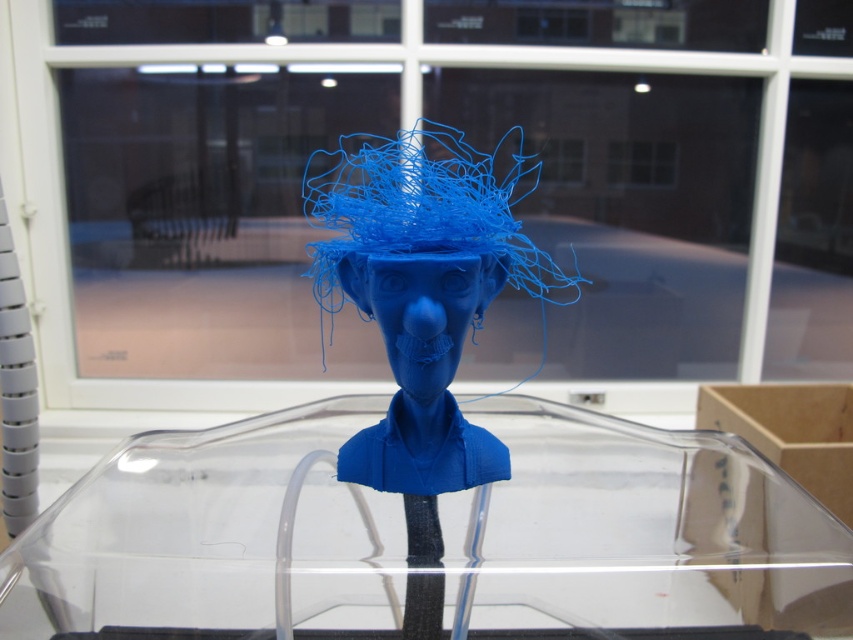
Can you confirm if transparent plastic container at center is bigger than matte plastic bust at center?

Correct, transparent plastic container at center is larger in size than matte plastic bust at center.

Consider the image. Can you confirm if transparent plastic container at center is taller than matte plastic bust at center?

In fact, transparent plastic container at center may be shorter than matte plastic bust at center.

Locate an element on the screen. This screenshot has width=853, height=640. transparent plastic container at center is located at coordinates (440, 538).

Is matte plastic bust at center positioned before matte blue bust at center?

Yes, matte plastic bust at center is closer to the viewer.

Between matte plastic bust at center and matte blue bust at center, which one appears on the left side from the viewer's perspective?

matte plastic bust at center

Is point (463, 225) positioned before point (474, 316)?

Yes, it is.

You are a GUI agent. You are given a task and a screenshot of the screen. Output one action in this format:
    pyautogui.click(x=<x>, y=<y>)
    Task: Click on the matte plastic bust at center
    This screenshot has height=640, width=853.
    Given the screenshot: What is the action you would take?
    pyautogui.click(x=422, y=305)

Can you confirm if transparent plastic container at center is bigger than matte blue bust at center?

Yes.

Which of these two, transparent plastic container at center or matte blue bust at center, stands shorter?

matte blue bust at center is shorter.

Locate an element on the screen. transparent plastic container at center is located at coordinates (440, 538).

The image size is (853, 640). Find the location of `transparent plastic container at center`. transparent plastic container at center is located at coordinates (440, 538).